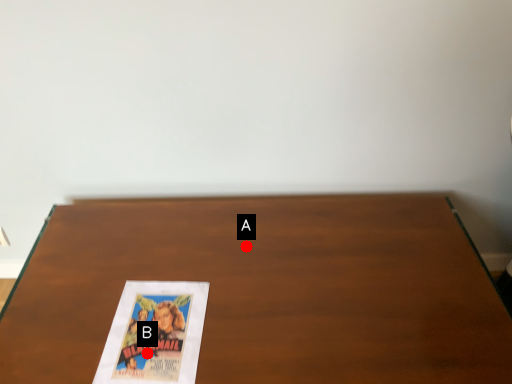
Question: Two points are circled on the image, labeled by A and B beside each circle. Which point is closer to the camera?

Choices:
 (A) A is closer
 (B) B is closer

Answer: (B)